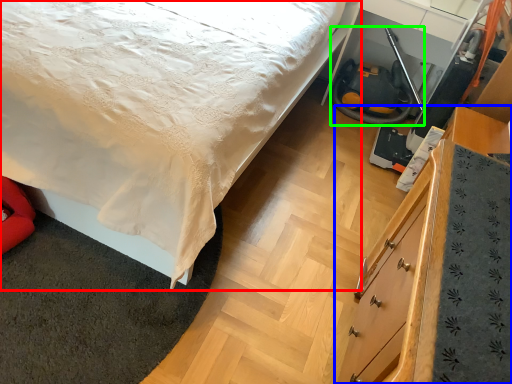
Question: Which is farther away from bed (highlighted by a red box)? chest of drawers (highlighted by a blue box) or fire hose (highlighted by a green box)?

Choices:
 (A) chest of drawers
 (B) fire hose

Answer: (B)